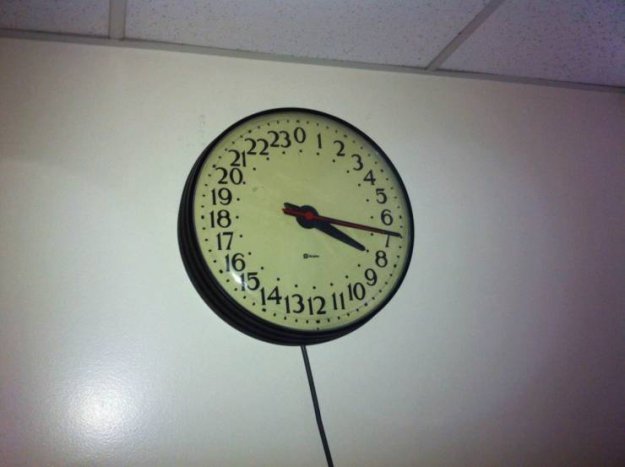
The width and height of the screenshot is (625, 467). Identify the location of ceiling. (585, 35).